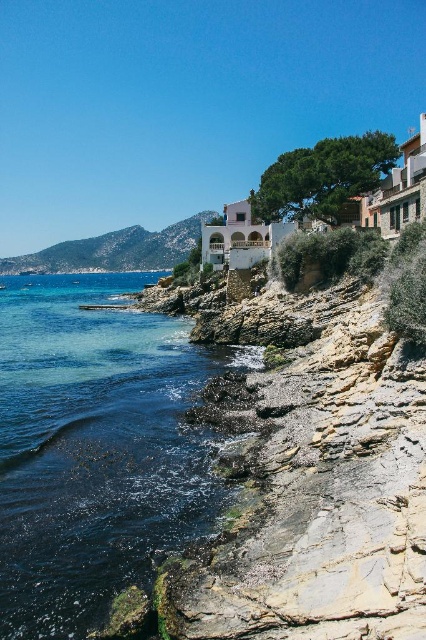
You are standing on the rocky cliffs and want to take a photo of the clear blue water at lower left and the green grassy hillside at upper left. Which object will appear narrower in the photo?

The clear blue water at lower left will appear narrower in the photo because it is thinner than the green grassy hillside at upper left.

You are standing at the edge of the cliff and want to take a photo of the clear blue water at lower left and the green grassy hillside at upper left. Which object will appear closer to the bottom of your camera view?

The clear blue water at lower left is positioned under the green grassy hillside at upper left, so it will appear closer to the bottom of your camera view.

You are standing at the center of the image and want to reach the clear blue water at lower left. Based on the coordinates provided in the description, is the water closer to the left or right side of the image?

The clear blue water at lower left is located at point 0.702 on the x and 0.225 on the y, so the water is closer to the right side of the image since the x coordinate is higher than 0.5.